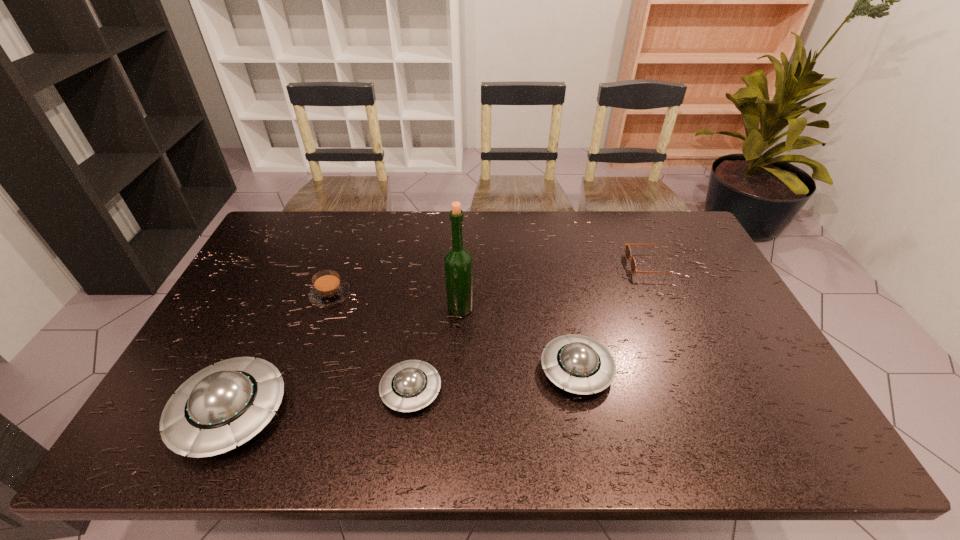
Find the location of a particular element. Image resolution: width=960 pixels, height=540 pixels. vacant position at the far edge of the desktop is located at coordinates (307, 248).

This screenshot has width=960, height=540. In order to click on vacant point at the near edge in this screenshot , I will do 559,388.

Where is `free space at the left edge of the desktop`? free space at the left edge of the desktop is located at coordinates (234, 353).

At what (x,y) coordinates should I click in order to perform the action: click on vacant space at the right edge of the desktop. Please return your answer as a coordinate pair (x, y). The width and height of the screenshot is (960, 540). Looking at the image, I should click on (684, 267).

I want to click on free space at the far left corner, so click(293, 231).

In the image, there is a desktop. Where is `blank space at the far right corner`? The width and height of the screenshot is (960, 540). blank space at the far right corner is located at coordinates (657, 222).

This screenshot has width=960, height=540. I want to click on vacant region between the shortest saucer and the second object from right to left, so click(x=493, y=380).

The height and width of the screenshot is (540, 960). I want to click on vacant space that is in between the liquor and the shortest saucer, so click(x=436, y=349).

The height and width of the screenshot is (540, 960). I want to click on vacant space that is in between the tallest saucer and the sunglasses, so click(x=441, y=339).

At what (x,y) coordinates should I click in order to perform the action: click on free space between the sunglasses and the cappuccino. Please return your answer as a coordinate pair (x, y). Looking at the image, I should click on (491, 280).